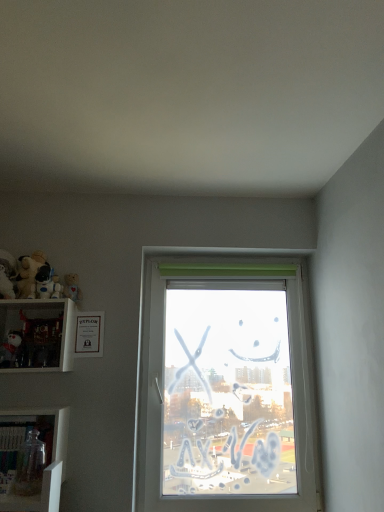
This screenshot has height=512, width=384. Identify the location of free space above white glossy shelf at left, the second shelf when ordered from bottom to top (from a real-world perspective). (34, 302).